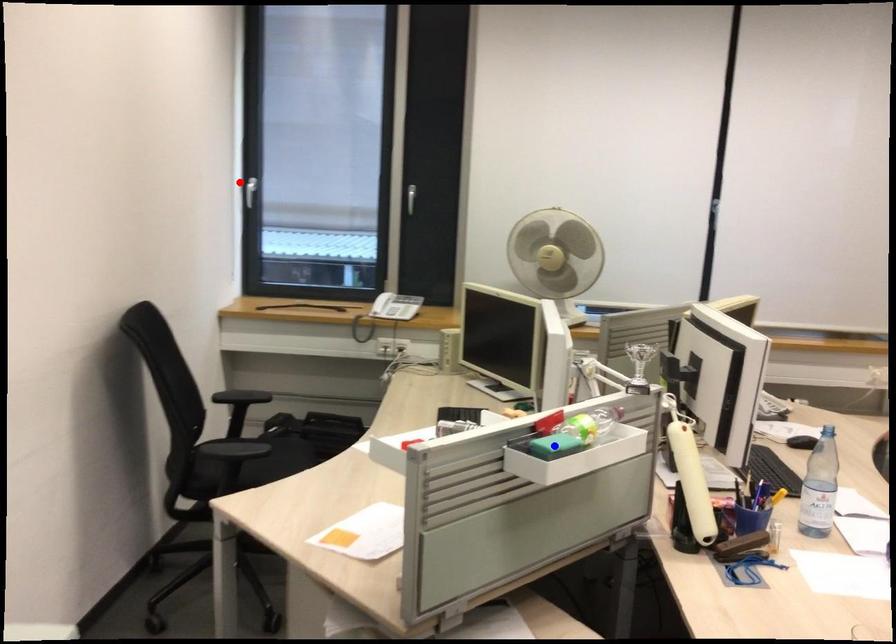
Question: In the image, two points are highlighted. Which point is nearer to the camera? Reply with the corresponding letter.

Choices:
 (A) blue point
 (B) red point

Answer: (A)